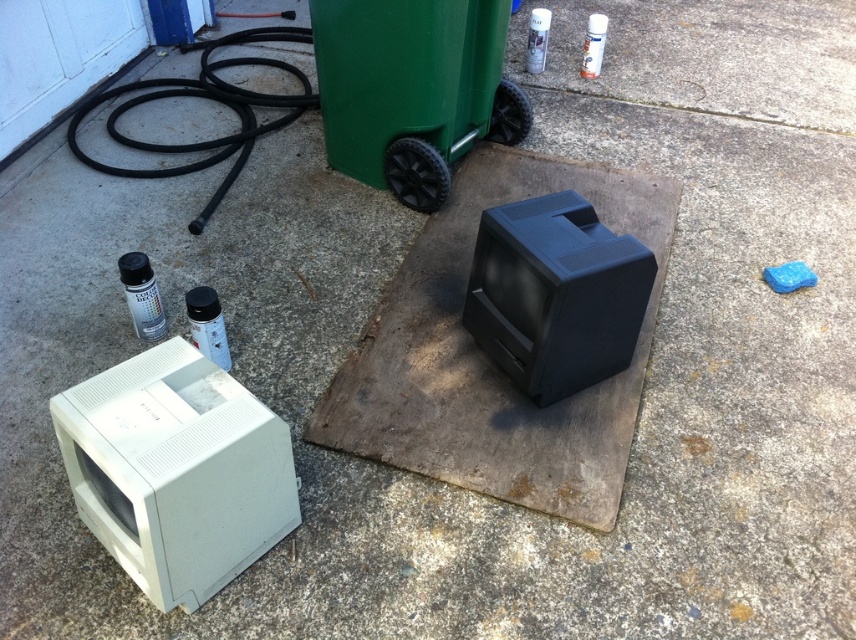
You are organizing a garage sale and need to arrange items properly. You have a white plastic monitor at lower left and a metallic spray can at lower left. Which item is positioned more to the right between the two?

The white plastic monitor at lower left is positioned more to the right than the metallic spray can at lower left.